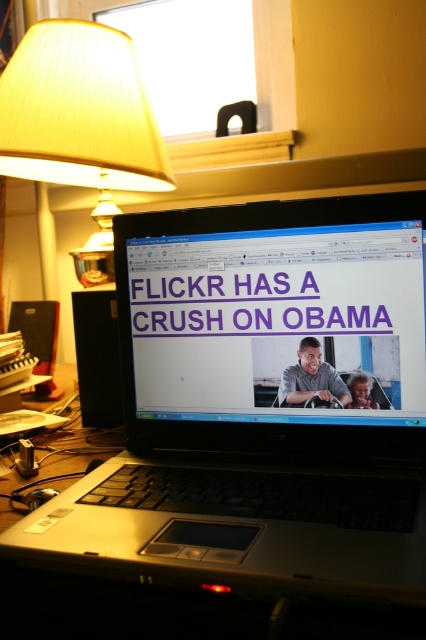
You are a photographer taking a picture of the workspace setup. The yellow pleated fabric lampshade at upper left is in your frame. Where exactly should you position your camera to capture the lampshade at the specified coordinates?

The yellow pleated fabric lampshade at upper left is located at point (80,118), so position the camera to focus on that coordinate to capture it.